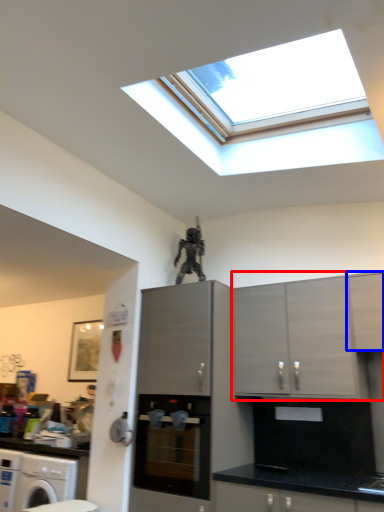
Question: Which object is closer to the camera taking this photo, cabinetry (highlighted by a red box) or cabinetry (highlighted by a blue box)?

Choices:
 (A) cabinetry
 (B) cabinetry

Answer: (B)